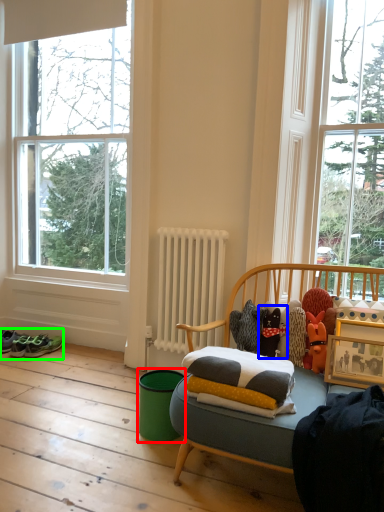
Question: Which object is positioned farthest from teal (highlighted by a red box)? Select from toy (highlighted by a blue box) and footwear (highlighted by a green box).

Choices:
 (A) toy
 (B) footwear

Answer: (B)